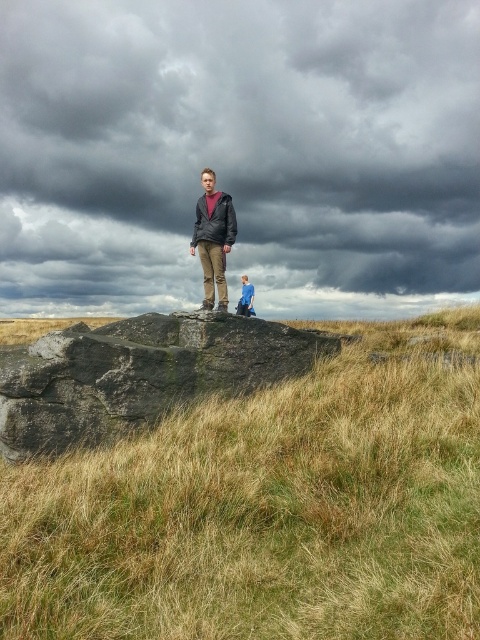
Is matte black jacket at center positioned before blue denim jacket at center?

Yes, it is in front of blue denim jacket at center.

Is matte black jacket at center below blue denim jacket at center?

Incorrect, matte black jacket at center is not positioned below blue denim jacket at center.

Find the location of a particular element. This screenshot has width=480, height=640. matte black jacket at center is located at coordinates (214, 237).

The width and height of the screenshot is (480, 640). What are the coordinates of `matte black jacket at center` in the screenshot? It's located at (214, 237).

Consider the image. Between dark gray stone boulder at center and blue denim jacket at center, which one has less height?

Standing shorter between the two is blue denim jacket at center.

Does dark gray stone boulder at center appear on the right side of blue denim jacket at center?

Incorrect, dark gray stone boulder at center is not on the right side of blue denim jacket at center.

Is point (50, 374) positioned before point (251, 292)?

That is True.

This screenshot has width=480, height=640. What are the coordinates of `dark gray stone boulder at center` in the screenshot? It's located at (137, 374).

Can you confirm if brown dry grass at center is positioned to the left of matte black jacket at center?

Incorrect, brown dry grass at center is not on the left side of matte black jacket at center.

Identify the location of brown dry grass at center. (268, 508).